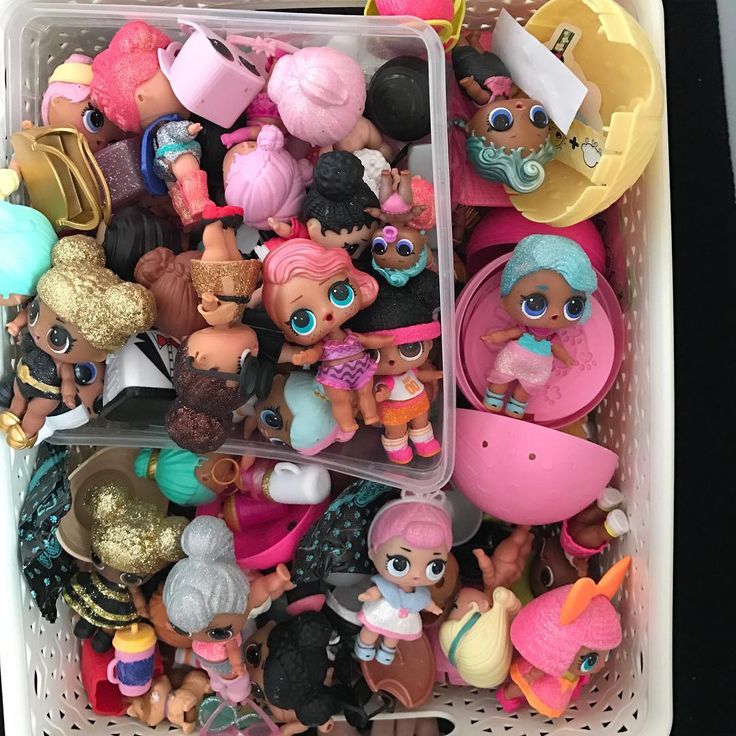
I want to click on dolls with blue hair, so click(513, 132), click(537, 271), click(388, 252), click(35, 247), click(311, 419), click(193, 470).